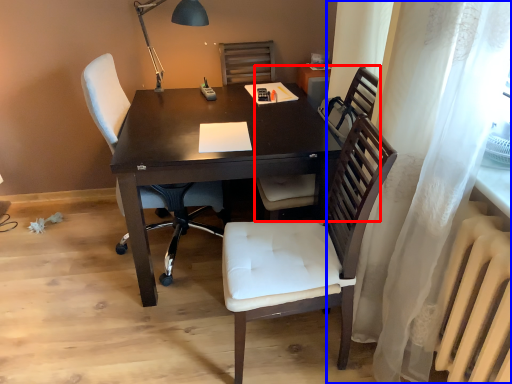
Question: Which object appears closest to the camera in this image, chair (highlighted by a red box) or curtain (highlighted by a blue box)?

Choices:
 (A) chair
 (B) curtain

Answer: (B)